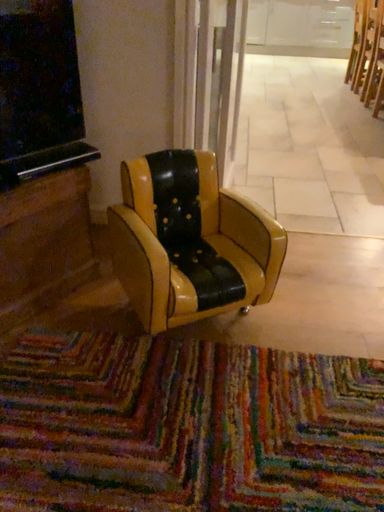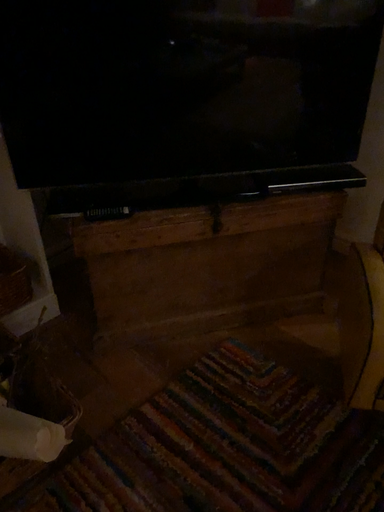
Question: Which way did the camera rotate in the video?

Choices:
 (A) rotated right
 (B) rotated left

Answer: (B)